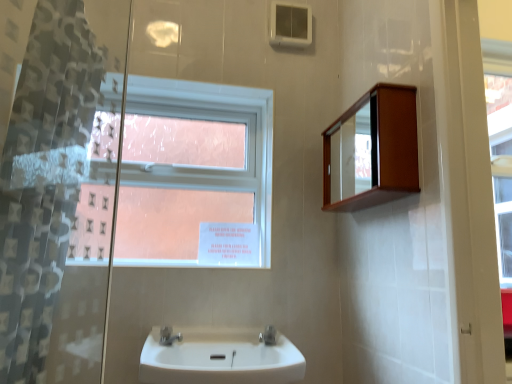
Question: Would you say white glossy sink at center is inside or outside clear glass window at upper center?

Choices:
 (A) outside
 (B) inside

Answer: (A)

Question: From a real-world perspective, is white glossy sink at center physically located above or below clear glass window at upper center?

Choices:
 (A) above
 (B) below

Answer: (B)

Question: Which is farther from the satin nickel faucet at sink center, acting as the 2th tap starting from the left?

Choices:
 (A) clear glass window at upper center
 (B) satin nickel faucet at lower center, arranged as the second tap when viewed from the right
 (C) wooden cabinet at upper right
 (D) white glossy sink at center
 (E) translucent plastic shower curtain at left

Answer: (E)

Question: Which object is the closest to the translucent plastic shower curtain at left?

Choices:
 (A) white glossy sink at center
 (B) satin nickel faucet at lower center, arranged as the second tap when viewed from the right
 (C) satin nickel faucet at sink center, acting as the 2th tap starting from the left
 (D) clear glass window at upper center
 (E) wooden cabinet at upper right

Answer: (A)